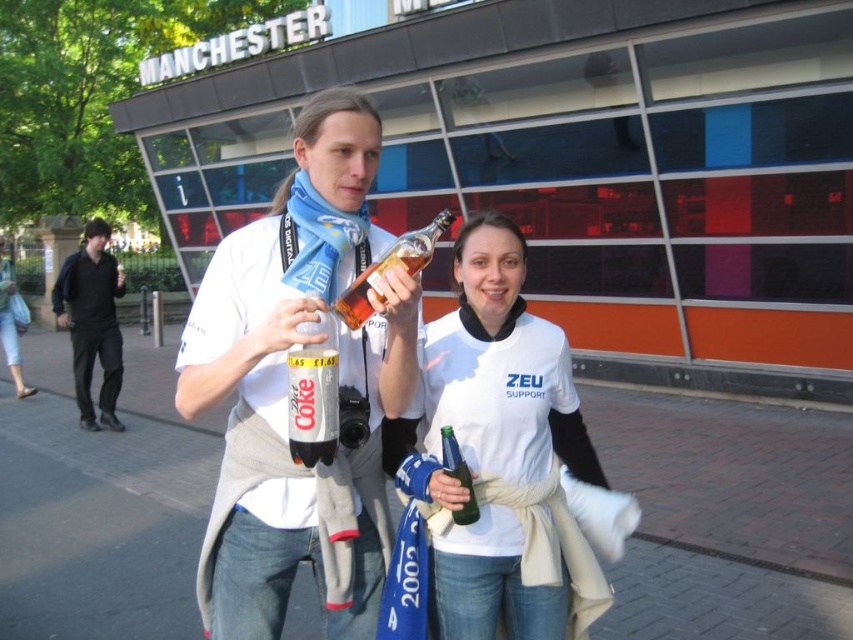
Can you confirm if matte plastic bottle at center is positioned to the left of translucent glass bottle at center?

Indeed, matte plastic bottle at center is positioned on the left side of translucent glass bottle at center.

Which of these two, matte plastic bottle at center or translucent glass bottle at center, stands shorter?

translucent glass bottle at center

Identify the location of matte plastic bottle at center. The height and width of the screenshot is (640, 853). (286, 390).

Can you confirm if translucent glass bottle at center is positioned to the left of green glass bottle at center?

Indeed, translucent glass bottle at center is positioned on the left side of green glass bottle at center.

Which is in front, point (376, 269) or point (453, 444)?

Point (376, 269)

The width and height of the screenshot is (853, 640). Identify the location of translucent glass bottle at center. (390, 268).

Is black cotton jacket at left bigger than translucent glass bottle at center?

Indeed, black cotton jacket at left has a larger size compared to translucent glass bottle at center.

The image size is (853, 640). Find the location of `black cotton jacket at left`. black cotton jacket at left is located at coordinates (91, 321).

Which is behind, point (113, 376) or point (421, 236)?

Positioned behind is point (113, 376).

Locate an element on the screen. The image size is (853, 640). black cotton jacket at left is located at coordinates (91, 321).